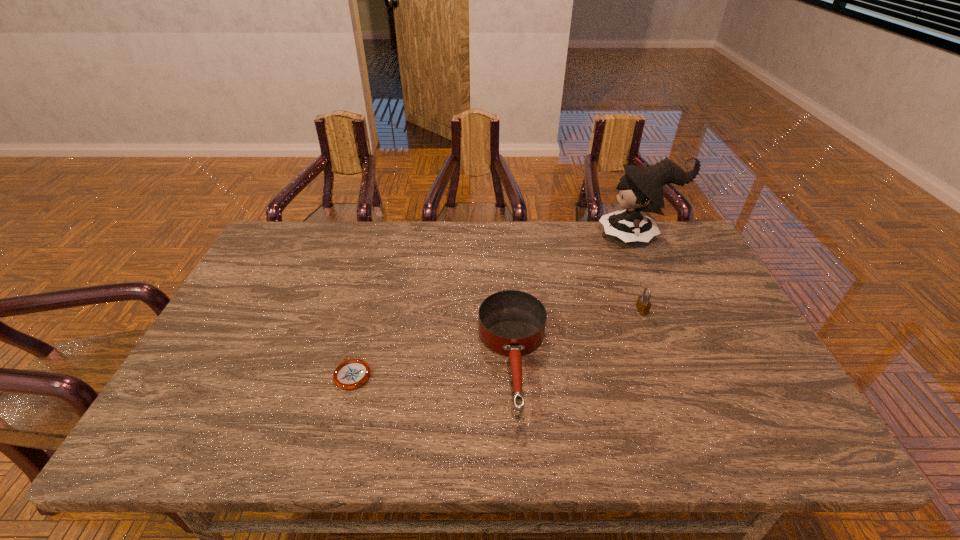
Where is `free space located 0.250m on the back of the leftmost object`? free space located 0.250m on the back of the leftmost object is located at coordinates (374, 292).

Locate an element on the screen. The height and width of the screenshot is (540, 960). object at the far edge is located at coordinates (641, 189).

The width and height of the screenshot is (960, 540). Find the location of `object at the near edge`. object at the near edge is located at coordinates (512, 323).

Identify the location of object at the right edge. Image resolution: width=960 pixels, height=540 pixels. (641, 189).

At what (x,y) coordinates should I click in order to perform the action: click on object that is positioned at the far right corner. Please return your answer as a coordinate pair (x, y). Image resolution: width=960 pixels, height=540 pixels. Looking at the image, I should click on (641, 189).

In the image, there is a desktop. Identify the location of vacant space at the far edge. (535, 234).

Where is `vacant space at the near edge of the desktop`? The image size is (960, 540). vacant space at the near edge of the desktop is located at coordinates (575, 441).

This screenshot has width=960, height=540. What are the coordinates of `free location at the left edge` in the screenshot? It's located at (250, 292).

This screenshot has height=540, width=960. What are the coordinates of `free location at the far left corner` in the screenshot? It's located at (269, 242).

I want to click on free location at the near left corner, so click(x=170, y=443).